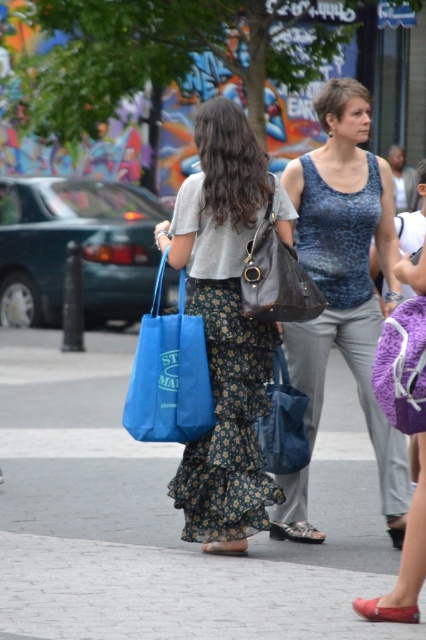
Can you confirm if matte red sandal at lower center is shorter than leather textured sandal at lower center?

Correct, matte red sandal at lower center is not as tall as leather textured sandal at lower center.

The image size is (426, 640). What do you see at coordinates (385, 611) in the screenshot?
I see `matte red sandal at lower center` at bounding box center [385, 611].

Between point (360, 598) and point (276, 536), which one is positioned behind?

Point (276, 536)

Identify the location of matte red sandal at lower center. This screenshot has width=426, height=640. (385, 611).

Is leather textured sandal at lower center bigger than black leather sandal at lower center?

Indeed, leather textured sandal at lower center has a larger size compared to black leather sandal at lower center.

Is leather textured sandal at lower center below black leather sandal at lower center?

Yes, leather textured sandal at lower center is below black leather sandal at lower center.

Who is more forward, (273, 532) or (397, 522)?

Point (397, 522) is more forward.

Where is `leather textured sandal at lower center`? The image size is (426, 640). leather textured sandal at lower center is located at coordinates [x=296, y=531].

Does floral skirt at center lie behind blue leopard print tank top at center?

No.

How distant is floral skirt at center from blue leopard print tank top at center?

floral skirt at center is 20.78 inches from blue leopard print tank top at center.

Who is more forward, (190,218) or (367,326)?

Point (190,218)

This screenshot has height=640, width=426. What are the coordinates of `floral skirt at center` in the screenshot? It's located at (224, 326).